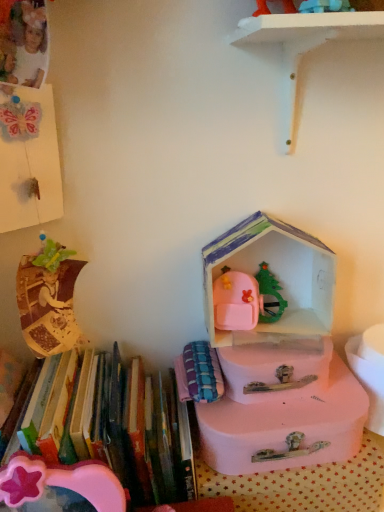
Question: Can hardcover books at left, placed as the 2th book when sorted from right to left, be found inside plaid fabric book at center, the first book viewed from the right?

Choices:
 (A) no
 (B) yes

Answer: (A)

Question: Is plaid fabric book at center, which ranks as the 2th book in left-to-right order, positioned beyond the bounds of hardcover books at left, placed as the first book when sorted from left to right?

Choices:
 (A) no
 (B) yes

Answer: (B)

Question: Is plaid fabric book at center, which ranks as the 2th book in left-to-right order, bigger than hardcover books at left, placed as the first book when sorted from left to right?

Choices:
 (A) no
 (B) yes

Answer: (A)

Question: Does plaid fabric book at center, the first book viewed from the right, have a lesser height compared to hardcover books at left, placed as the 2th book when sorted from right to left?

Choices:
 (A) no
 (B) yes

Answer: (B)

Question: Is plaid fabric book at center, which ranks as the 2th book in left-to-right order, touching hardcover books at left, placed as the first book when sorted from left to right?

Choices:
 (A) no
 (B) yes

Answer: (A)

Question: Is plaid fabric book at center, which ranks as the 2th book in left-to-right order, bigger or smaller than pink plastic box at center?

Choices:
 (A) small
 (B) big

Answer: (A)

Question: Would you say plaid fabric book at center, which ranks as the 2th book in left-to-right order, is to the left or to the right of pink plastic box at center in the picture?

Choices:
 (A) right
 (B) left

Answer: (B)

Question: Considering their positions, is plaid fabric book at center, which ranks as the 2th book in left-to-right order, located in front of or behind pink plastic box at center?

Choices:
 (A) front
 (B) behind

Answer: (A)

Question: From the image's perspective, is plaid fabric book at center, which ranks as the 2th book in left-to-right order, positioned above or below pink plastic box at center?

Choices:
 (A) below
 (B) above

Answer: (A)

Question: From the image's perspective, relative to pink plastic suitcase at center, which ranks as the second storage box in top-to-bottom order, is plaid fabric book at center, which ranks as the 2th book in left-to-right order, above or below?

Choices:
 (A) below
 (B) above

Answer: (B)

Question: Considering the positions of point (196, 393) and point (259, 467), is point (196, 393) closer or farther from the camera than point (259, 467)?

Choices:
 (A) closer
 (B) farther

Answer: (B)

Question: Relative to pink plastic suitcase at center, which ranks as the second storage box in top-to-bottom order, is plaid fabric book at center, the first book viewed from the right, in front or behind?

Choices:
 (A) front
 (B) behind

Answer: (B)

Question: In terms of size, does plaid fabric book at center, the first book viewed from the right, appear bigger or smaller than pink plastic suitcase at center, the 1th storage box positioned from the bottom?

Choices:
 (A) small
 (B) big

Answer: (A)

Question: Which is correct: pink plastic box at center is inside pink cardboard house at center, acting as the 1th storage box starting from the top, or outside of it?

Choices:
 (A) outside
 (B) inside

Answer: (A)

Question: In the image, is pink plastic box at center positioned in front of or behind pink cardboard house at center, positioned as the second storage box in bottom-to-top order?

Choices:
 (A) behind
 (B) front

Answer: (A)